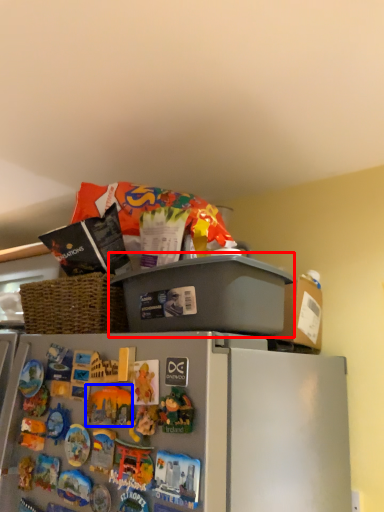
Question: Which object appears farthest to the camera in this image, appliance (highlighted by a red box) or toy (highlighted by a blue box)?

Choices:
 (A) appliance
 (B) toy

Answer: (A)